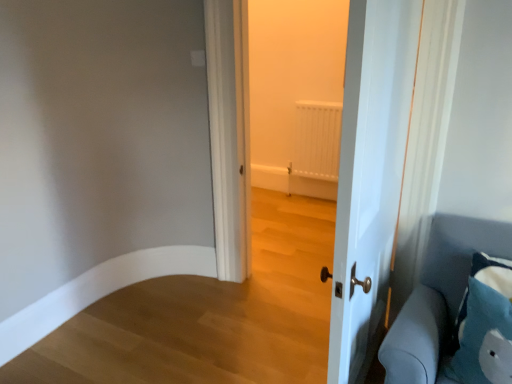
Question: Considering the relative sizes of blue fabric pillow at lower right and blue fabric pillow at lower right in the image provided, is blue fabric pillow at lower right thinner than blue fabric pillow at lower right?

Choices:
 (A) yes
 (B) no

Answer: (B)

Question: Is blue fabric pillow at lower right not close to blue fabric pillow at lower right?

Choices:
 (A) no
 (B) yes

Answer: (A)

Question: Can you confirm if blue fabric pillow at lower right is positioned to the right of blue fabric pillow at lower right?

Choices:
 (A) yes
 (B) no

Answer: (B)

Question: From the image's perspective, is blue fabric pillow at lower right beneath blue fabric pillow at lower right?

Choices:
 (A) no
 (B) yes

Answer: (B)

Question: From a real-world perspective, does blue fabric pillow at lower right sit lower than blue fabric pillow at lower right?

Choices:
 (A) no
 (B) yes

Answer: (B)

Question: Would you say blue fabric pillow at lower right is to the left or to the right of blue fabric pillow at lower right in the picture?

Choices:
 (A) right
 (B) left

Answer: (A)

Question: From a real-world perspective, is blue fabric pillow at lower right positioned above or below blue fabric pillow at lower right?

Choices:
 (A) above
 (B) below

Answer: (A)

Question: In terms of size, does blue fabric pillow at lower right appear bigger or smaller than blue fabric pillow at lower right?

Choices:
 (A) big
 (B) small

Answer: (B)

Question: Choose the correct answer: Is blue fabric pillow at lower right inside blue fabric pillow at lower right or outside it?

Choices:
 (A) inside
 (B) outside

Answer: (B)

Question: Is blue fabric pillow at lower right wider or thinner than white glossy door at center?

Choices:
 (A) thin
 (B) wide

Answer: (B)

Question: Relative to white glossy door at center, is blue fabric pillow at lower right in front or behind?

Choices:
 (A) front
 (B) behind

Answer: (B)

Question: Considering the positions of blue fabric pillow at lower right and white glossy door at center in the image, is blue fabric pillow at lower right bigger or smaller than white glossy door at center?

Choices:
 (A) big
 (B) small

Answer: (B)

Question: From a real-world perspective, is blue fabric pillow at lower right physically located above or below white glossy door at center?

Choices:
 (A) below
 (B) above

Answer: (A)

Question: Considering their positions, is white glossy door at center located in front of or behind blue fabric pillow at lower right?

Choices:
 (A) behind
 (B) front

Answer: (B)

Question: From their relative heights in the image, would you say white glossy door at center is taller or shorter than blue fabric pillow at lower right?

Choices:
 (A) short
 (B) tall

Answer: (B)